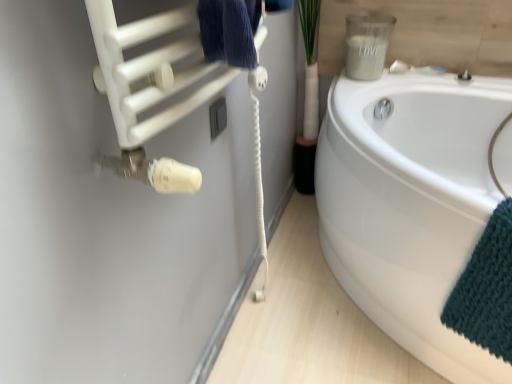
Question: Is satin nickel faucet at upper right at the left side of white matte towel at upper left?

Choices:
 (A) no
 (B) yes

Answer: (A)

Question: Does satin nickel faucet at upper right have a greater height compared to white matte towel at upper left?

Choices:
 (A) yes
 (B) no

Answer: (B)

Question: Does satin nickel faucet at upper right have a lesser width compared to white matte towel at upper left?

Choices:
 (A) no
 (B) yes

Answer: (B)

Question: Does satin nickel faucet at upper right have a smaller size compared to white matte towel at upper left?

Choices:
 (A) yes
 (B) no

Answer: (A)

Question: Can white matte towel at upper left be found inside satin nickel faucet at upper right?

Choices:
 (A) yes
 (B) no

Answer: (B)

Question: From the image's perspective, relative to white glossy bathtub at lower right, is white matte towel at upper left above or below?

Choices:
 (A) above
 (B) below

Answer: (B)

Question: Would you say white matte towel at upper left is inside or outside white glossy bathtub at lower right?

Choices:
 (A) outside
 (B) inside

Answer: (A)

Question: Is white matte towel at upper left in front of or behind white glossy bathtub at lower right in the image?

Choices:
 (A) behind
 (B) front

Answer: (B)

Question: Considering the positions of white matte towel at upper left and white glossy bathtub at lower right in the image, is white matte towel at upper left bigger or smaller than white glossy bathtub at lower right?

Choices:
 (A) big
 (B) small

Answer: (B)

Question: Is white matte towel at upper left to the left or to the right of teal knitted towel at lower right in the image?

Choices:
 (A) left
 (B) right

Answer: (A)

Question: In terms of width, does white matte towel at upper left look wider or thinner when compared to teal knitted towel at lower right?

Choices:
 (A) wide
 (B) thin

Answer: (B)

Question: Is white matte towel at upper left bigger or smaller than teal knitted towel at lower right?

Choices:
 (A) big
 (B) small

Answer: (A)

Question: From a real-world perspective, is white matte towel at upper left above or below teal knitted towel at lower right?

Choices:
 (A) below
 (B) above

Answer: (B)

Question: From a real-world perspective, is white glossy bathtub at lower right positioned above or below teal knitted towel at lower right?

Choices:
 (A) below
 (B) above

Answer: (A)

Question: In terms of height, does white glossy bathtub at lower right look taller or shorter compared to teal knitted towel at lower right?

Choices:
 (A) tall
 (B) short

Answer: (A)